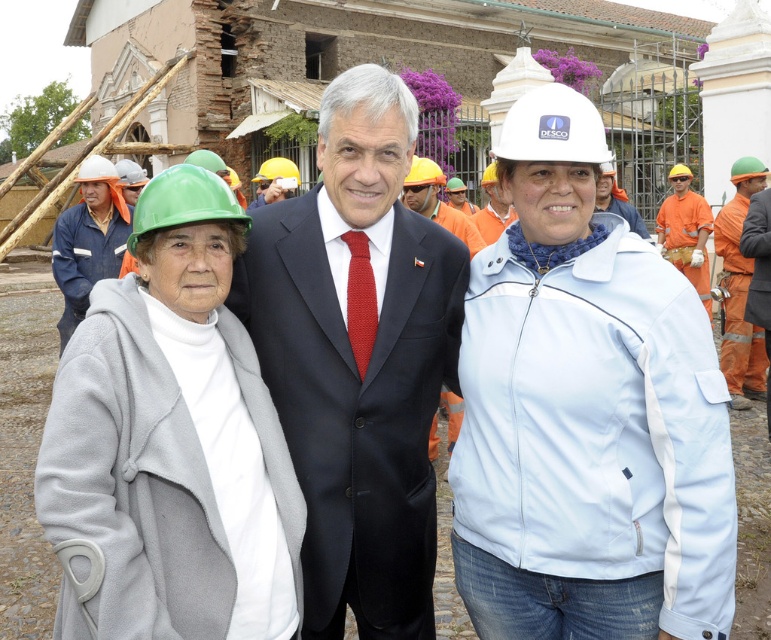
Question: Can you confirm if white hard hat at center is positioned above orange fabric uniform at center?

Choices:
 (A) yes
 (B) no

Answer: (B)

Question: Is green matte hard hat at left above matte black suit at center?

Choices:
 (A) yes
 (B) no

Answer: (A)

Question: Which is nearer to the green hard hat at left?

Choices:
 (A) matte black suit at center
 (B) orange fabric uniform at center
 (C) white hard hat at center
 (D) orange fabric construction worker at center

Answer: (A)

Question: Is white hard hat at center smaller than green matte hard hat at left?

Choices:
 (A) no
 (B) yes

Answer: (A)

Question: Which point is farther to the camera?

Choices:
 (A) (64, 326)
 (B) (732, 392)
 (C) (352, 240)

Answer: (B)

Question: Based on their relative distances, which object is farther from the white hard hat at center?

Choices:
 (A) orange fabric construction worker at center
 (B) green hard hat at left
 (C) green matte hard hat at left

Answer: (A)